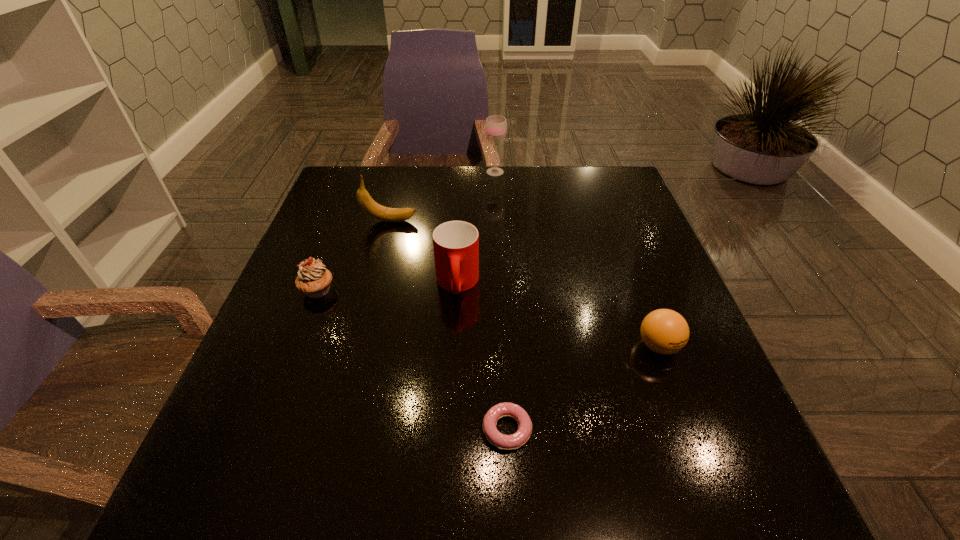
I want to click on the farthest object, so click(x=496, y=126).

Find the location of a particular element. banana is located at coordinates (380, 212).

You are a GUI agent. You are given a task and a screenshot of the screen. Output one action in this format:
    pyautogui.click(x=<x>, y=<y>)
    Task: Click on the fifth object from right to left
    The height and width of the screenshot is (540, 960).
    Given the screenshot: What is the action you would take?
    (x=380, y=212)

The height and width of the screenshot is (540, 960). Identify the location of cup. (456, 243).

This screenshot has height=540, width=960. Identify the location of cupcake. (313, 279).

What are the coordinates of `ping-pong ball` in the screenshot? It's located at (664, 331).

This screenshot has height=540, width=960. What are the coordinates of `the rightmost object` in the screenshot? It's located at (664, 331).

Locate an element on the screen. The image size is (960, 540). doughnut is located at coordinates (506, 442).

Locate an element on the screen. the nearest object is located at coordinates (506, 442).

What are the coordinates of `free space located 0.080m on the left of the wineglass` in the screenshot? It's located at (458, 172).